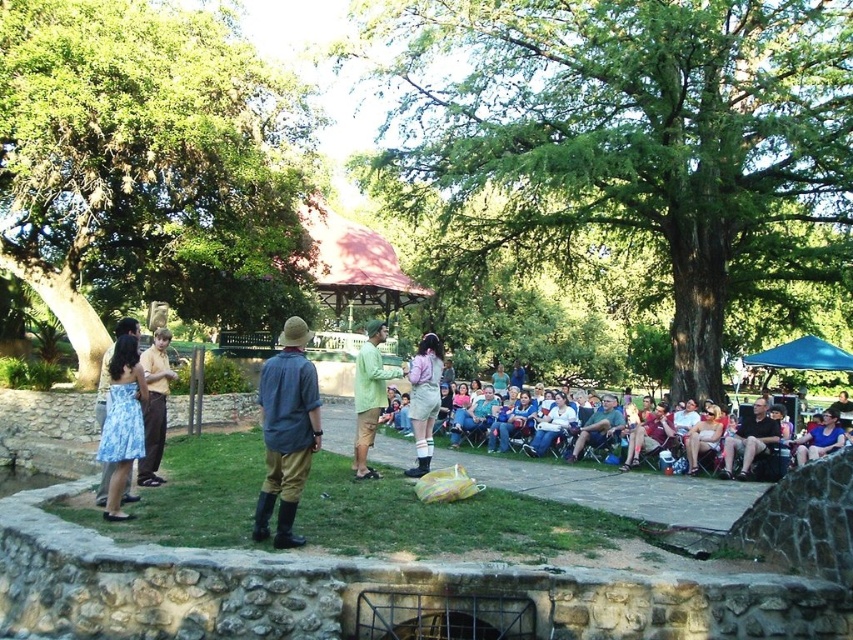
You are a photographer trying to capture both the blue floral dress at lower left and the green matte shirt at center in the same frame. Since you want to ensure both are visible, which clothing item should you focus on first to avoid blurring due to its size?

The blue floral dress at lower left is thinner than the green matte shirt at center, so you should focus on the green matte shirt at center first as it is larger and might require more precise focus to capture details without blurring.

You are standing at the center of the park and see a point marked at coordinates [144,161]. What object is located at that point?

The point at coordinates [144,161] indicates a green leafy tree at upper left.